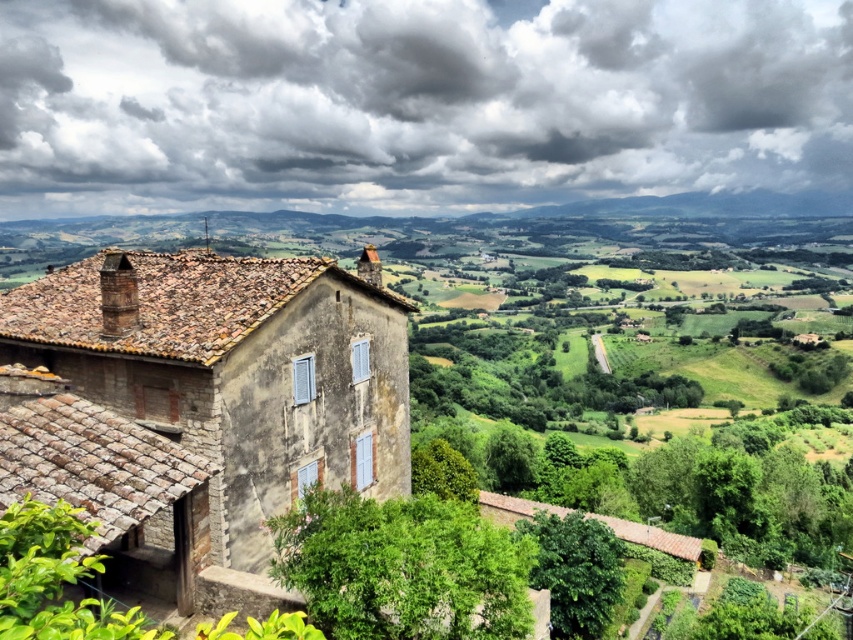
Does cloudy sky at upper center have a greater width compared to stone house at center?

Yes.

Does cloudy sky at upper center appear on the right side of stone house at center?

Yes, cloudy sky at upper center is to the right of stone house at center.

Find the location of `cloudy sky at upper center`. cloudy sky at upper center is located at coordinates (415, 102).